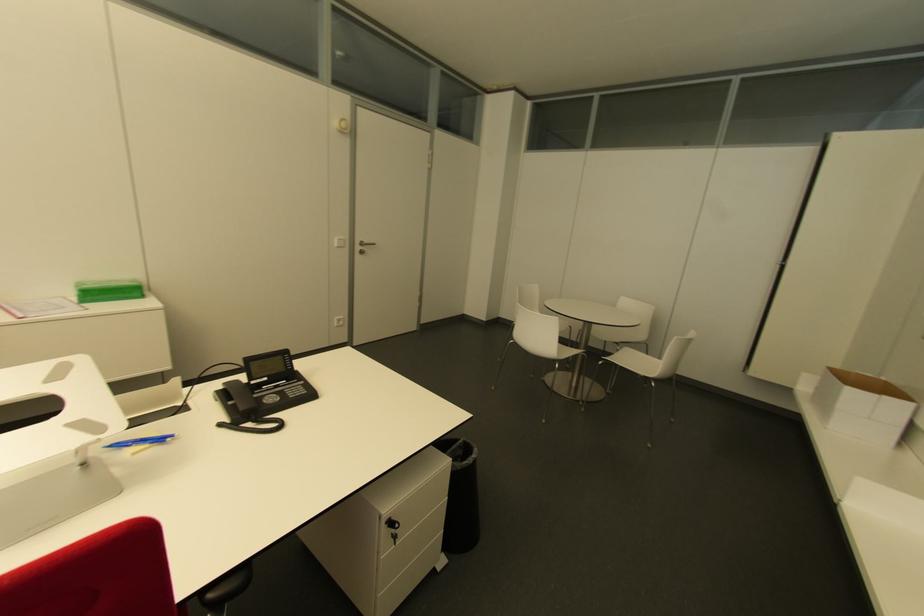
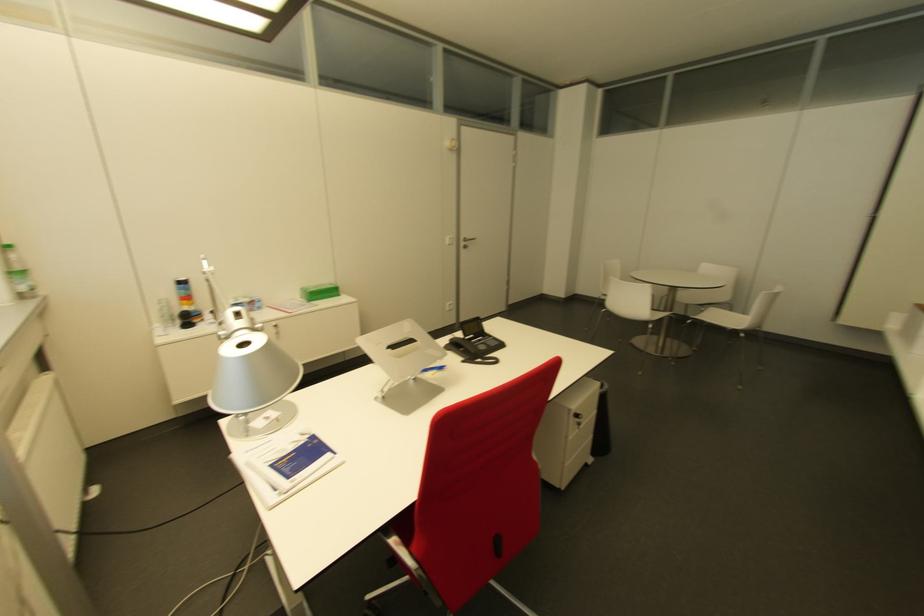
Find the pixel in the second image that matches the point at 394,525 in the first image.

(579, 418)